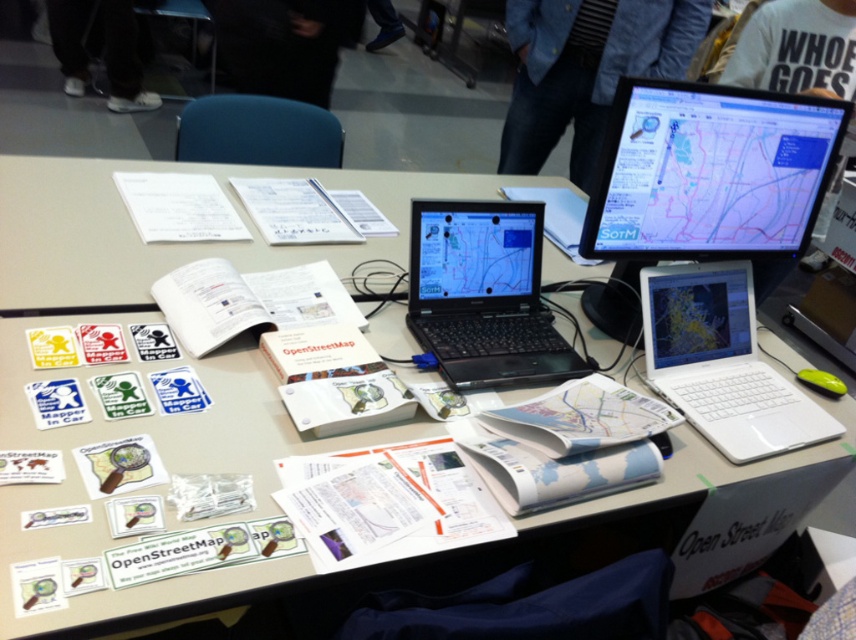
Question: Is black glossy monitor at upper right thinner than white paper at upper left?

Choices:
 (A) yes
 (B) no

Answer: (B)

Question: Which is farther from the white cotton shirt at upper right?

Choices:
 (A) blue denim jacket at upper center
 (B) black glossy monitor at upper right

Answer: (B)

Question: Can you confirm if black plastic laptop at center is bigger than black fabric at center?

Choices:
 (A) no
 (B) yes

Answer: (A)

Question: Considering the real-world distances, which object is farthest from the white paper at upper left?

Choices:
 (A) blue denim jacket at upper center
 (B) black glossy monitor at upper right
 (C) white fabric pants at lower left

Answer: (C)

Question: Estimate the real-world distances between objects in this image. Which object is farther from the white fabric pants at lower left?

Choices:
 (A) black glossy monitor at upper right
 (B) white paper at upper left

Answer: (A)

Question: Where is blue denim jacket at upper center located in relation to white plastic laptop at center-right in the image?

Choices:
 (A) above
 (B) below

Answer: (A)